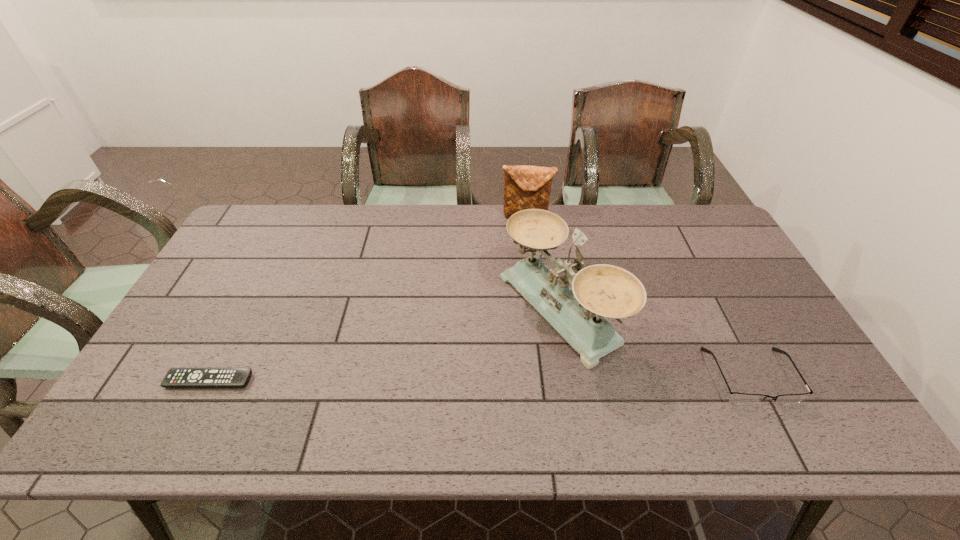
Locate an element on the screen. Image resolution: width=960 pixels, height=540 pixels. free space that is in between the farthest object and the shortest object is located at coordinates (368, 299).

Where is `vacant space that is in between the remote control and the tallest object`? Image resolution: width=960 pixels, height=540 pixels. vacant space that is in between the remote control and the tallest object is located at coordinates (384, 345).

The height and width of the screenshot is (540, 960). I want to click on empty space that is in between the shortest object and the rightmost object, so click(480, 379).

Find the location of `vacant region between the second shortest object and the shortest object`. vacant region between the second shortest object and the shortest object is located at coordinates (480, 379).

Choose which object is the third nearest neighbor to the second shortest object. Please provide its 2D coordinates. Your answer should be formatted as a tuple, i.e. [(x, y)], where the tuple contains the x and y coordinates of a point satisfying the conditions above.

[(176, 377)]

The image size is (960, 540). Identify the location of the third closest object to the spectacles. (176, 377).

Locate an element on the screen. free location that satisfies the following two spatial constraints: 1. on the back side of the third shortest object; 2. on the left side of the shortest object is located at coordinates (293, 216).

Locate an element on the screen. The height and width of the screenshot is (540, 960). free spot that satisfies the following two spatial constraints: 1. on the back side of the leftmost object; 2. on the right side of the second tallest object is located at coordinates point(293,216).